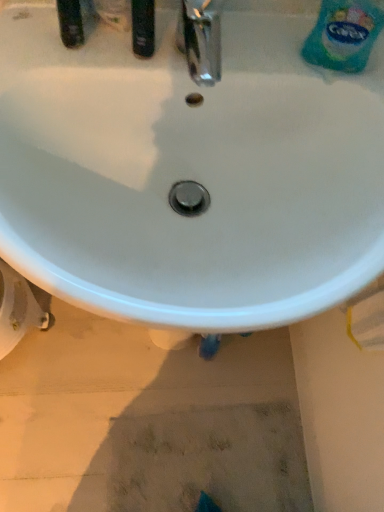
Question: Considering the relative sizes of white plastic bidet at lower left and blue plastic bottle at upper right in the image provided, is white plastic bidet at lower left thinner than blue plastic bottle at upper right?

Choices:
 (A) no
 (B) yes

Answer: (A)

Question: Is white plastic bidet at lower left smaller than blue plastic bottle at upper right?

Choices:
 (A) no
 (B) yes

Answer: (A)

Question: From a real-world perspective, is white plastic bidet at lower left physically above blue plastic bottle at upper right?

Choices:
 (A) yes
 (B) no

Answer: (B)

Question: From the image's perspective, is white plastic bidet at lower left over blue plastic bottle at upper right?

Choices:
 (A) yes
 (B) no

Answer: (B)

Question: Does white plastic bidet at lower left have a lesser height compared to blue plastic bottle at upper right?

Choices:
 (A) yes
 (B) no

Answer: (B)

Question: Is white plastic bidet at lower left to the right of blue plastic bottle at upper right from the viewer's perspective?

Choices:
 (A) yes
 (B) no

Answer: (B)

Question: Is white glossy sink at center in contact with white plastic bidet at lower left?

Choices:
 (A) yes
 (B) no

Answer: (B)

Question: From a real-world perspective, is white glossy sink at center physically above white plastic bidet at lower left?

Choices:
 (A) yes
 (B) no

Answer: (A)

Question: Considering the relative sizes of white glossy sink at center and white plastic bidet at lower left in the image provided, is white glossy sink at center smaller than white plastic bidet at lower left?

Choices:
 (A) no
 (B) yes

Answer: (A)

Question: Does white glossy sink at center lie in front of white plastic bidet at lower left?

Choices:
 (A) no
 (B) yes

Answer: (B)

Question: Can you confirm if white glossy sink at center is taller than white plastic bidet at lower left?

Choices:
 (A) yes
 (B) no

Answer: (A)

Question: Is white glossy sink at center oriented towards white plastic bidet at lower left?

Choices:
 (A) yes
 (B) no

Answer: (B)

Question: Can you confirm if white plastic bidet at lower left is taller than white glossy sink at center?

Choices:
 (A) yes
 (B) no

Answer: (B)